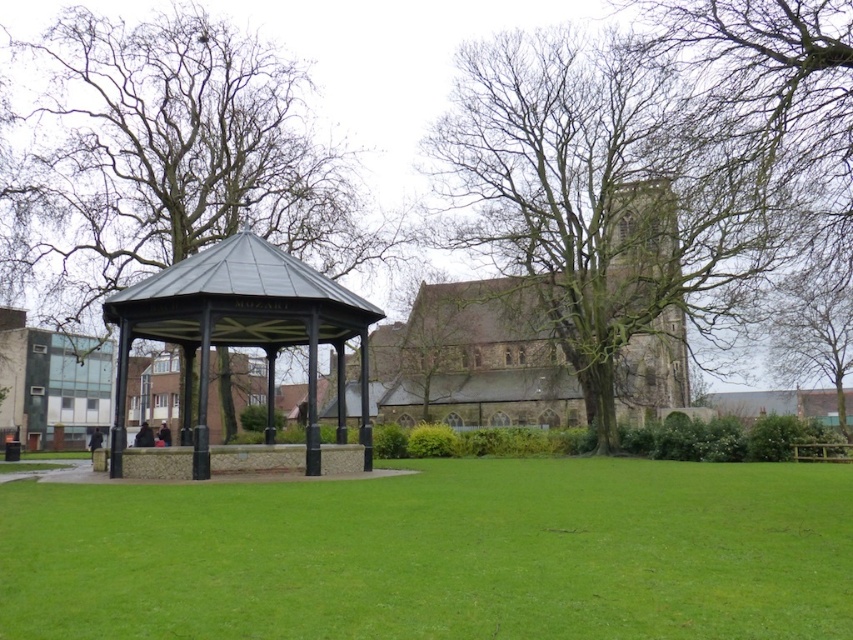
Who is more forward, (x=201, y=262) or (x=834, y=310)?

Point (x=201, y=262) is more forward.

Can you confirm if black metal gazebo at center is positioned below green leafy tree at upper right?

No.

I want to click on black metal gazebo at center, so click(x=242, y=330).

Can you confirm if green mossy tree at upper right is positioned to the left of bare branches at center?

Incorrect, green mossy tree at upper right is not on the left side of bare branches at center.

Who is lower down, green mossy tree at upper right or bare branches at center?

Positioned lower is green mossy tree at upper right.

Which is in front, point (576, 237) or point (73, 314)?

Point (576, 237) is more forward.

Image resolution: width=853 pixels, height=640 pixels. I want to click on green mossy tree at upper right, so click(x=611, y=189).

Is metallic gazebo at center shorter than black metal gazebo at center?

No.

Which is below, metallic gazebo at center or black metal gazebo at center?

Positioned lower is metallic gazebo at center.

Image resolution: width=853 pixels, height=640 pixels. I want to click on metallic gazebo at center, so click(x=479, y=356).